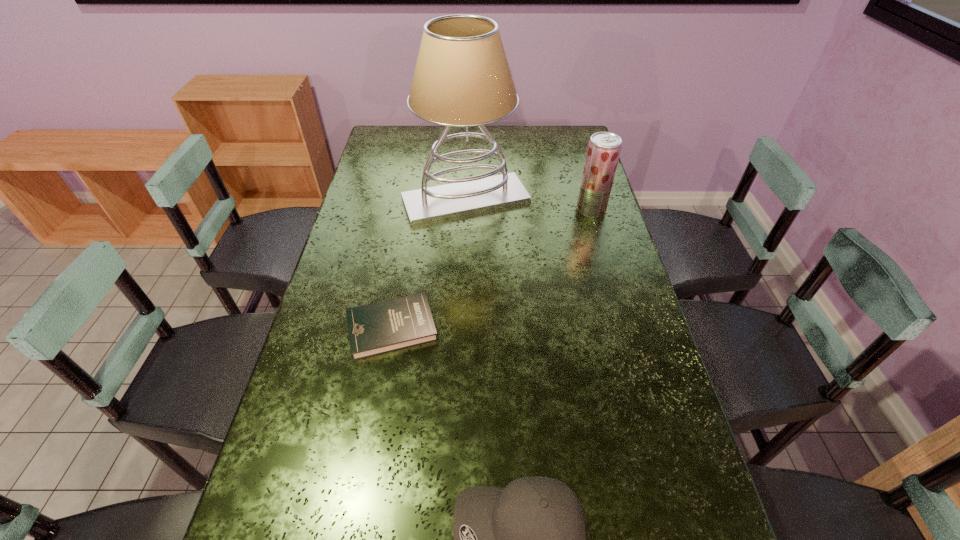
This screenshot has width=960, height=540. Find the location of `vacant space at the far edge`. vacant space at the far edge is located at coordinates (461, 151).

The image size is (960, 540). In the image, there is a desktop. In order to click on vacant space at the left edge in this screenshot , I will do `click(374, 211)`.

The height and width of the screenshot is (540, 960). Find the location of `vacant area at the right edge of the desktop`. vacant area at the right edge of the desktop is located at coordinates (576, 155).

Image resolution: width=960 pixels, height=540 pixels. I want to click on empty space between the shortest object and the fruit juice, so click(x=492, y=269).

Identify the location of vacant space in between the shortest object and the tallest object. (429, 264).

Find the location of a particular element. The image size is (960, 540). empty space between the shortest object and the table lamp is located at coordinates (429, 264).

This screenshot has height=540, width=960. I want to click on object that is the nearest to the second nearest object, so click(x=462, y=78).

This screenshot has height=540, width=960. Find the location of `object identified as the closest to the nearest object`. object identified as the closest to the nearest object is located at coordinates pos(389,325).

In order to click on blank space that satisfies the following two spatial constraints: 1. on the back side of the tallest object; 2. on the left side of the shortest object in this screenshot , I will do `click(414, 200)`.